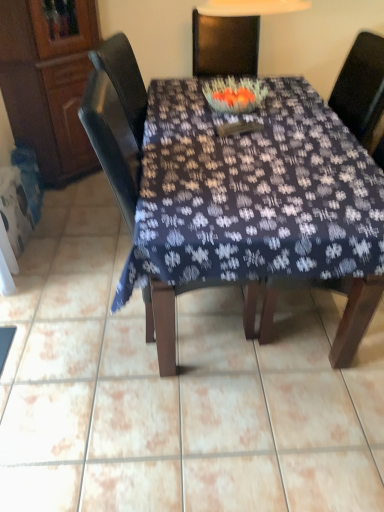
Question: From a real-world perspective, is dark fabric table at center below wooden chair at center, which is counted as the 1th chair, starting from the right?

Choices:
 (A) no
 (B) yes

Answer: (B)

Question: Does dark fabric table at center have a lesser height compared to wooden chair at center, marked as the 2th chair in a left-to-right arrangement?

Choices:
 (A) yes
 (B) no

Answer: (A)

Question: Considering the relative positions of dark fabric table at center and wooden chair at center, marked as the 2th chair in a left-to-right arrangement, in the image provided, is dark fabric table at center in front of wooden chair at center, marked as the 2th chair in a left-to-right arrangement,?

Choices:
 (A) no
 (B) yes

Answer: (B)

Question: Is dark fabric table at center smaller than wooden chair at center, which is counted as the 1th chair, starting from the right?

Choices:
 (A) yes
 (B) no

Answer: (B)

Question: Is dark fabric table at center to the left of wooden chair at center, which is counted as the 1th chair, starting from the right, from the viewer's perspective?

Choices:
 (A) no
 (B) yes

Answer: (B)

Question: Considering the positions of point (x=173, y=84) and point (x=28, y=129), is point (x=173, y=84) closer or farther from the camera than point (x=28, y=129)?

Choices:
 (A) farther
 (B) closer

Answer: (B)

Question: Do you think dark fabric table at center is within wooden cabinet at left, or outside of it?

Choices:
 (A) outside
 (B) inside

Answer: (A)

Question: Is dark fabric table at center wider or thinner than wooden cabinet at left?

Choices:
 (A) thin
 (B) wide

Answer: (B)

Question: From their relative heights in the image, would you say dark fabric table at center is taller or shorter than wooden cabinet at left?

Choices:
 (A) tall
 (B) short

Answer: (B)

Question: Considering the positions of wooden cabinet at left and wooden chair at center, marked as the 2th chair in a left-to-right arrangement, in the image, is wooden cabinet at left taller or shorter than wooden chair at center, marked as the 2th chair in a left-to-right arrangement,?

Choices:
 (A) tall
 (B) short

Answer: (A)

Question: Is wooden cabinet at left situated inside wooden chair at center, marked as the 2th chair in a left-to-right arrangement, or outside?

Choices:
 (A) outside
 (B) inside

Answer: (A)

Question: In the image, is wooden cabinet at left positioned in front of or behind wooden chair at center, marked as the 2th chair in a left-to-right arrangement?

Choices:
 (A) behind
 (B) front

Answer: (A)

Question: Based on their sizes in the image, would you say wooden cabinet at left is bigger or smaller than wooden chair at center, marked as the 2th chair in a left-to-right arrangement?

Choices:
 (A) small
 (B) big

Answer: (A)

Question: In terms of height, does dark fabric table at center look taller or shorter compared to wooden chair at center, which is counted as the 1th chair, starting from the right?

Choices:
 (A) tall
 (B) short

Answer: (B)

Question: From the image's perspective, is dark fabric table at center above or below wooden chair at center, which is counted as the 1th chair, starting from the right?

Choices:
 (A) above
 (B) below

Answer: (A)